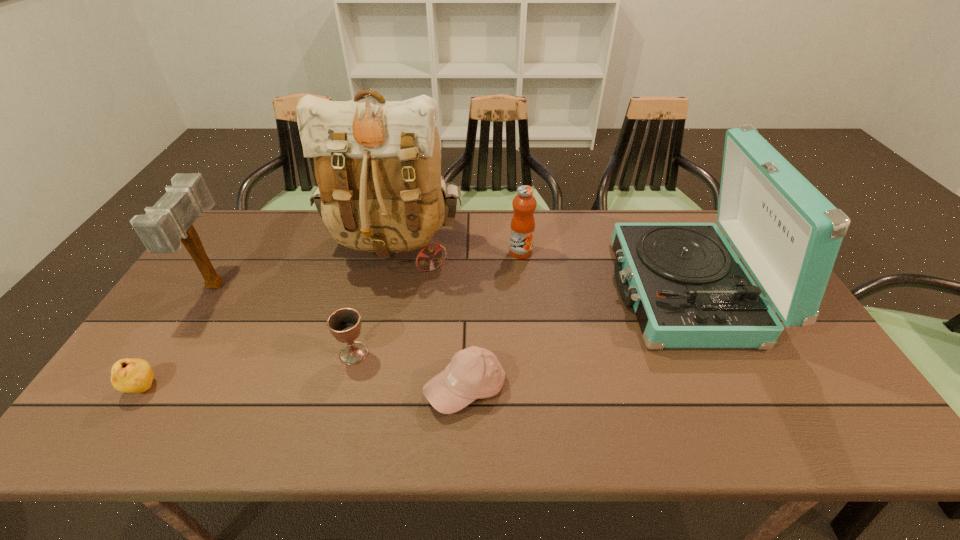
The height and width of the screenshot is (540, 960). I want to click on free region located 0.350m on the face side of the rightmost object, so click(x=496, y=291).

This screenshot has height=540, width=960. Identify the location of vacant space located 0.270m on the face side of the rightmost object. (523, 291).

The image size is (960, 540). In order to click on free region located on the face side of the rightmost object in this screenshot , I will do `click(480, 291)`.

Locate an element on the screen. This screenshot has height=540, width=960. vacant space situated 0.090m on the front of the third tallest object is located at coordinates (182, 339).

I want to click on vacant space located on the front label of the fruit juice, so click(x=531, y=350).

Where is `vacant region located 0.130m on the back of the fifth tallest object`? The width and height of the screenshot is (960, 540). vacant region located 0.130m on the back of the fifth tallest object is located at coordinates click(367, 305).

Locate an element on the screen. vacant space located 0.280m on the right of the pear is located at coordinates (275, 388).

You are a GUI agent. You are given a task and a screenshot of the screen. Output one action in this format:
    pyautogui.click(x=<x>, y=<y>)
    Task: Click on the backpack positioned at the far edge
    This screenshot has height=540, width=960.
    Given the screenshot: What is the action you would take?
    pyautogui.click(x=377, y=164)

Where is `record player that is at the far edge`? record player that is at the far edge is located at coordinates (688, 288).

The width and height of the screenshot is (960, 540). I want to click on fruit juice at the far edge, so click(522, 229).